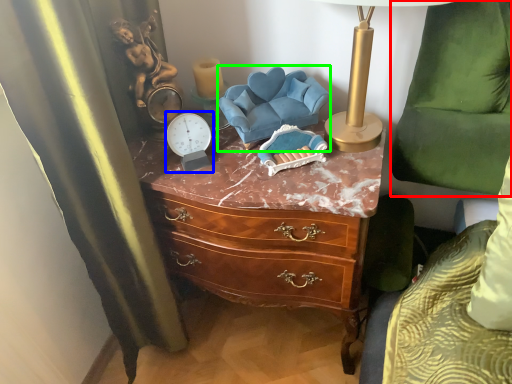
Question: Which is farther away from swivel chair (highlighted by a red box)? clock (highlighted by a blue box) or swivel chair (highlighted by a green box)?

Choices:
 (A) clock
 (B) swivel chair

Answer: (A)